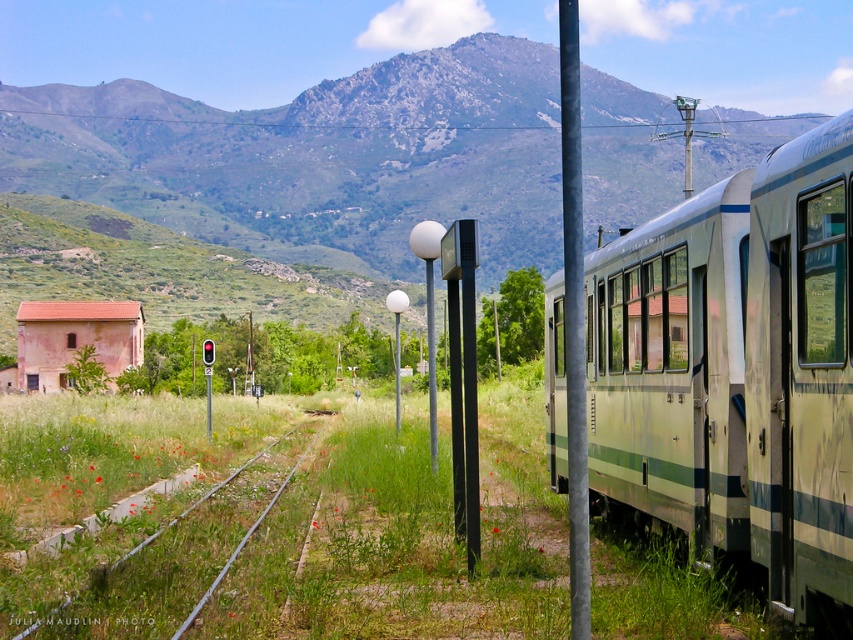
Between green grassy track at center and clear glass window at right, which one appears on the right side from the viewer's perspective?

Positioned to the right is clear glass window at right.

Can you confirm if green grassy track at center is smaller than clear glass window at right?

Incorrect, green grassy track at center is not smaller in size than clear glass window at right.

Is point (39, 432) positioned in front of point (838, 220)?

No, (39, 432) is behind (838, 220).

Locate an element on the screen. The height and width of the screenshot is (640, 853). green grassy track at center is located at coordinates (129, 506).

Is point (64, 449) farther from viewer compared to point (587, 493)?

Yes, point (64, 449) is farther from viewer.

This screenshot has height=640, width=853. Describe the element at coordinates (129, 506) in the screenshot. I see `green grassy track at center` at that location.

Does point (79, 476) lie behind point (575, 563)?

That is True.

I want to click on green grassy track at center, so click(129, 506).

Does green metallic train at right lie behind green grassy track at center?

No, green metallic train at right is closer to the viewer.

In the scene shown: Who is positioned more to the left, green metallic train at right or green grassy track at center?

From the viewer's perspective, green grassy track at center appears more on the left side.

Does point (709, 241) come in front of point (100, 477)?

Yes, it is.

This screenshot has height=640, width=853. Find the location of `green metallic train at right`. green metallic train at right is located at coordinates (735, 372).